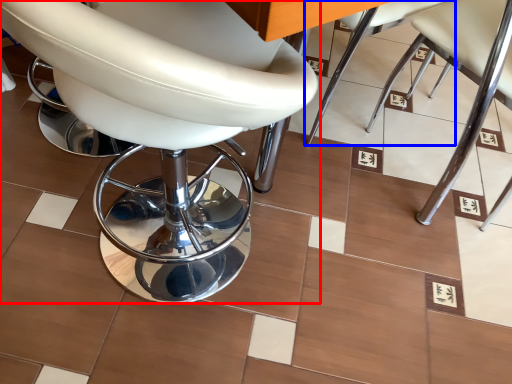
Question: Among these objects, which one is nearest to the camera, chair (highlighted by a red box) or chair (highlighted by a blue box)?

Choices:
 (A) chair
 (B) chair

Answer: (A)